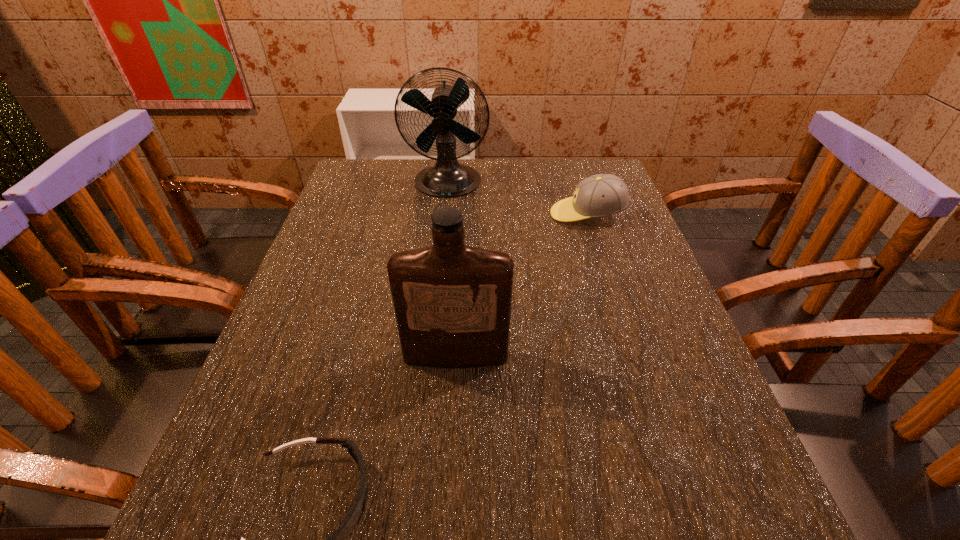
Where is `empty space that is in between the fan and the baseball cap`? The height and width of the screenshot is (540, 960). empty space that is in between the fan and the baseball cap is located at coordinates (517, 199).

The width and height of the screenshot is (960, 540). Find the location of `vacant area between the third tallest object and the liquor`. vacant area between the third tallest object and the liquor is located at coordinates (521, 285).

Find the location of a particular element. This screenshot has width=960, height=540. object identified as the closest to the nearest object is located at coordinates (452, 302).

I want to click on object that is the third closest to the rightmost object, so click(x=337, y=539).

Identify the location of free space that satisfies the following two spatial constraints: 1. on the front-facing side of the rightmost object; 2. on the label side of the second nearest object. (633, 356).

At what (x,y) coordinates should I click in order to perform the action: click on vacant position in the image that satisfies the following two spatial constraints: 1. on the front-facing side of the baseball cap; 2. on the label side of the second nearest object. Please return your answer as a coordinate pair (x, y). This screenshot has height=540, width=960. Looking at the image, I should click on (633, 356).

Find the location of `free spot that satisfies the following two spatial constraints: 1. on the front-facing side of the baseball cap; 2. on the label side of the third farthest object`. free spot that satisfies the following two spatial constraints: 1. on the front-facing side of the baseball cap; 2. on the label side of the third farthest object is located at coordinates (633, 356).